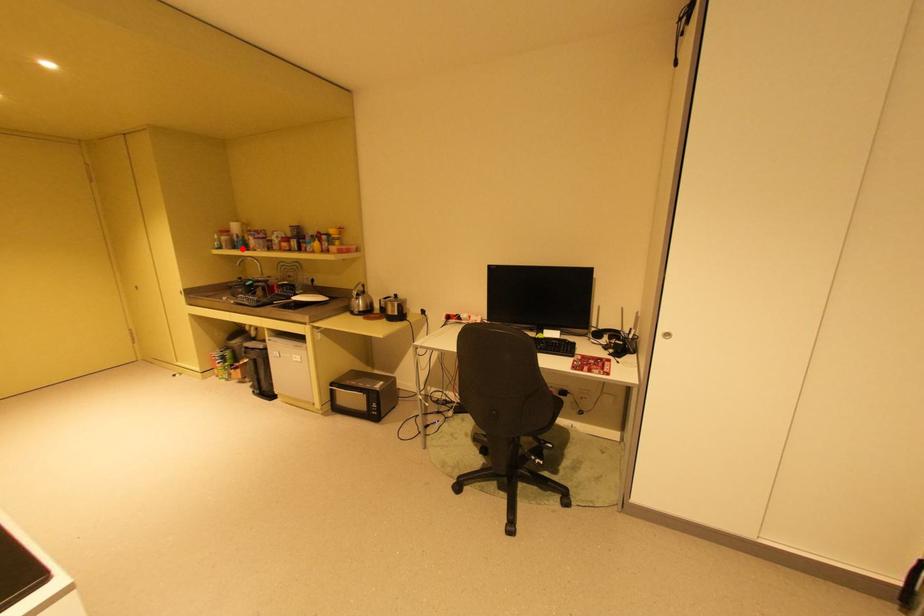
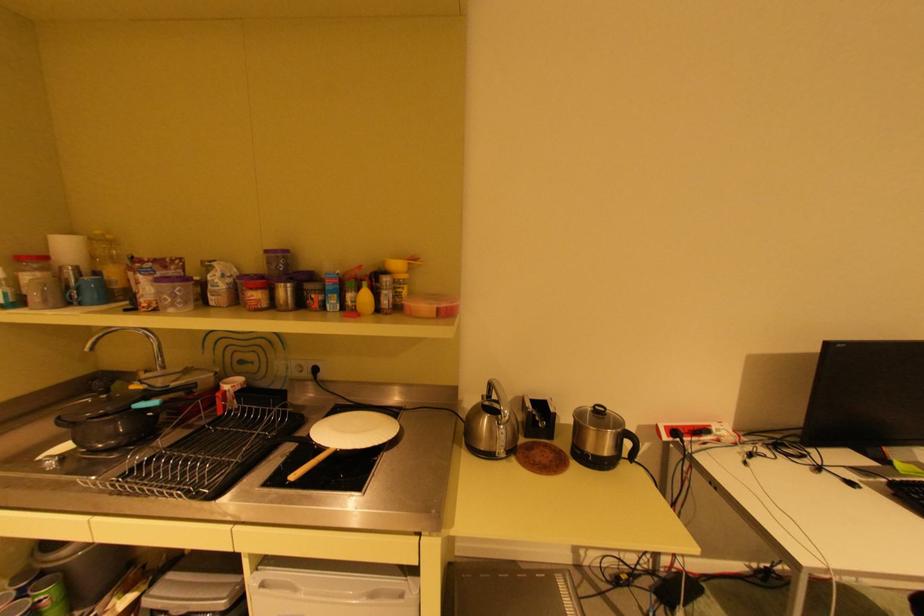
Locate, in the second image, the point that corresponds to the highlighted location in the first image.

(79, 302)